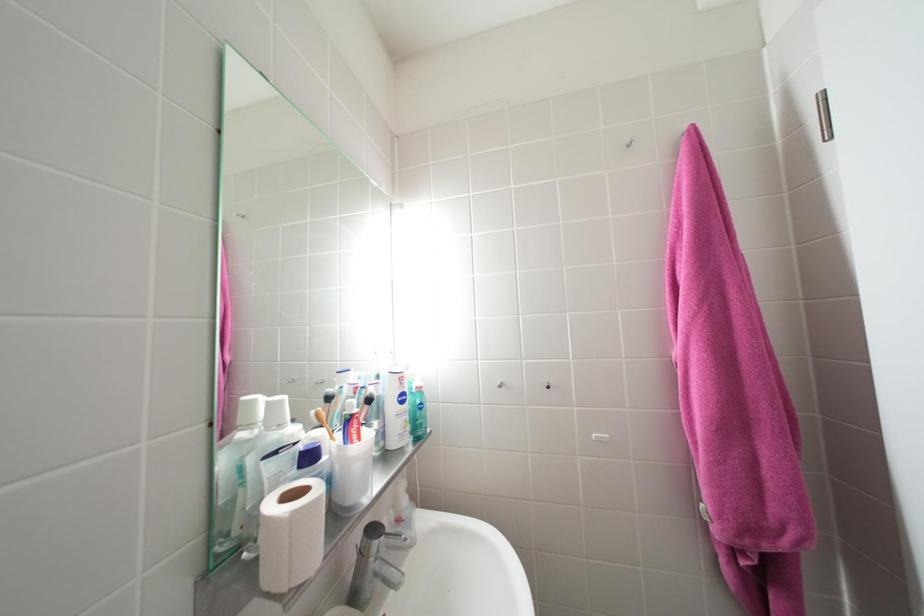
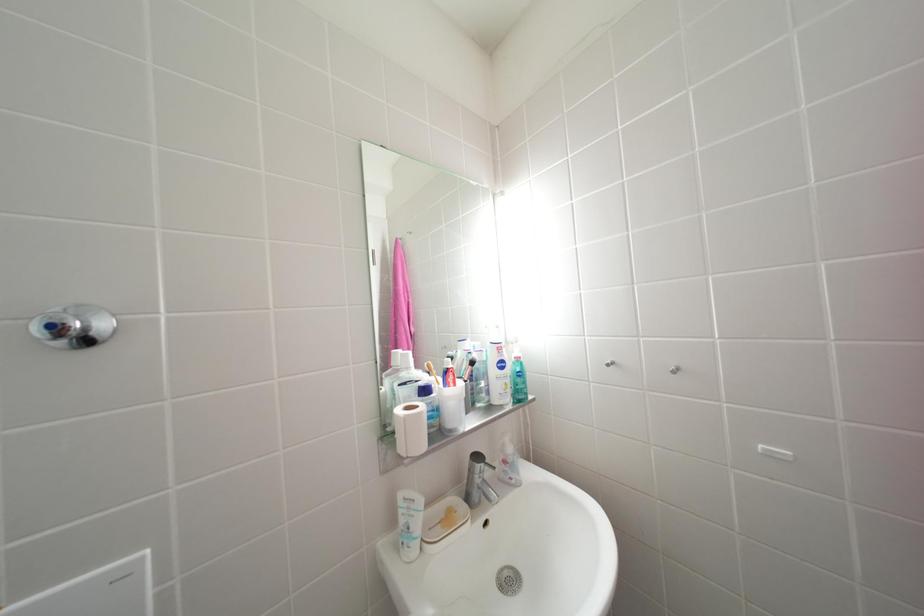
Question: The images are taken continuously from a first-person perspective. In which direction is your viewpoint rotating?

Choices:
 (A) Left
 (B) Right
 (C) Up
 (D) Down

Answer: (A)